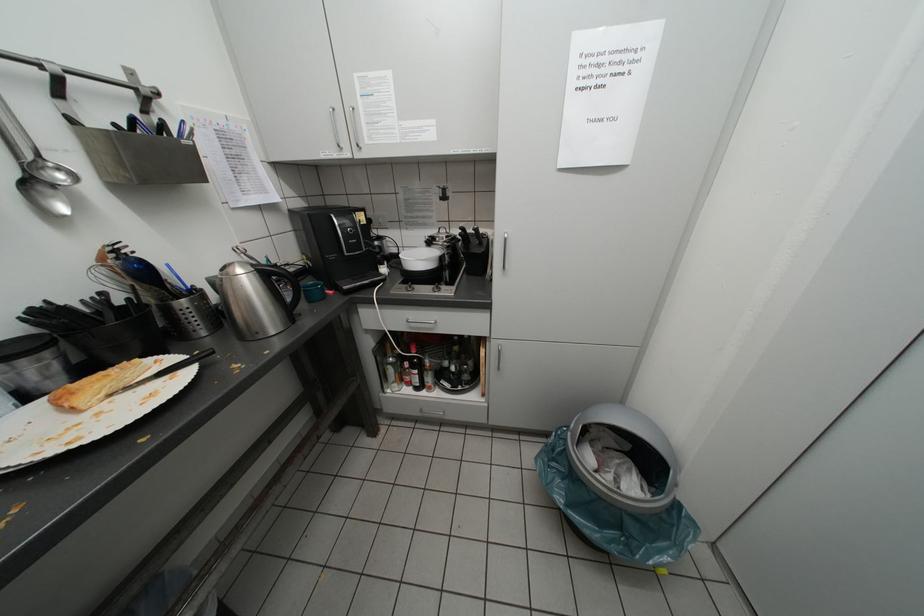
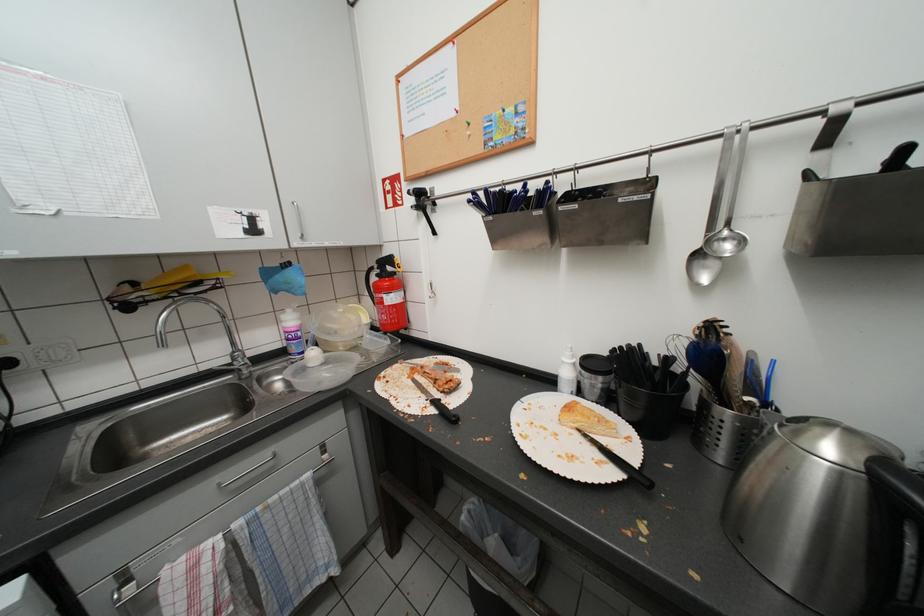
First-person continuous shooting, in which direction is the camera rotating?

The rotation direction of the camera is left-down.